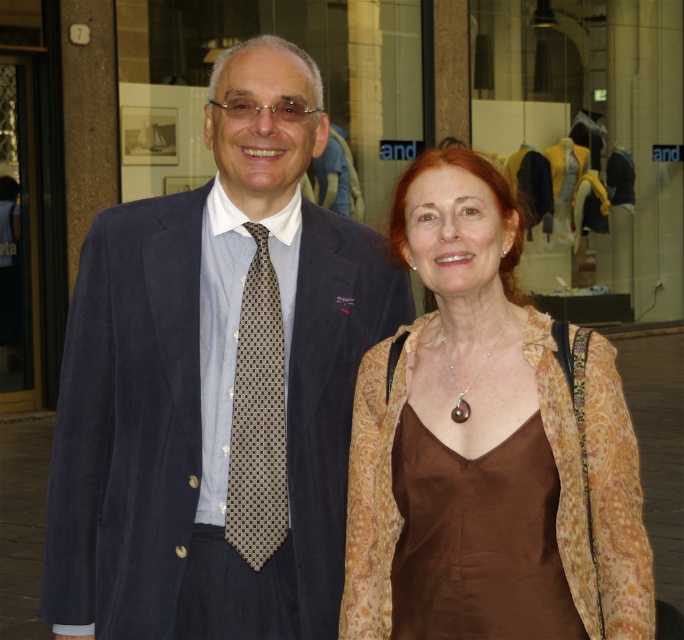
Question: Considering the real-world distances, which object is closest to the brown silk dress at center?

Choices:
 (A) brown satin dress at center
 (B) brown dotted tie at center
 (C) suede suit at center

Answer: (A)

Question: Can you confirm if brown satin dress at center is smaller than brown dotted tie at center?

Choices:
 (A) no
 (B) yes

Answer: (A)

Question: Which of the following is the closest to the observer?

Choices:
 (A) brown silk dress at center
 (B) brown satin dress at center

Answer: (B)

Question: Is suede suit at center further to camera compared to brown satin dress at center?

Choices:
 (A) no
 (B) yes

Answer: (B)

Question: Which point appears farthest from the camera in this image?

Choices:
 (A) (540, 522)
 (B) (282, 371)
 (C) (70, 406)

Answer: (C)

Question: Does brown satin dress at center have a lesser width compared to brown silk dress at center?

Choices:
 (A) yes
 (B) no

Answer: (B)